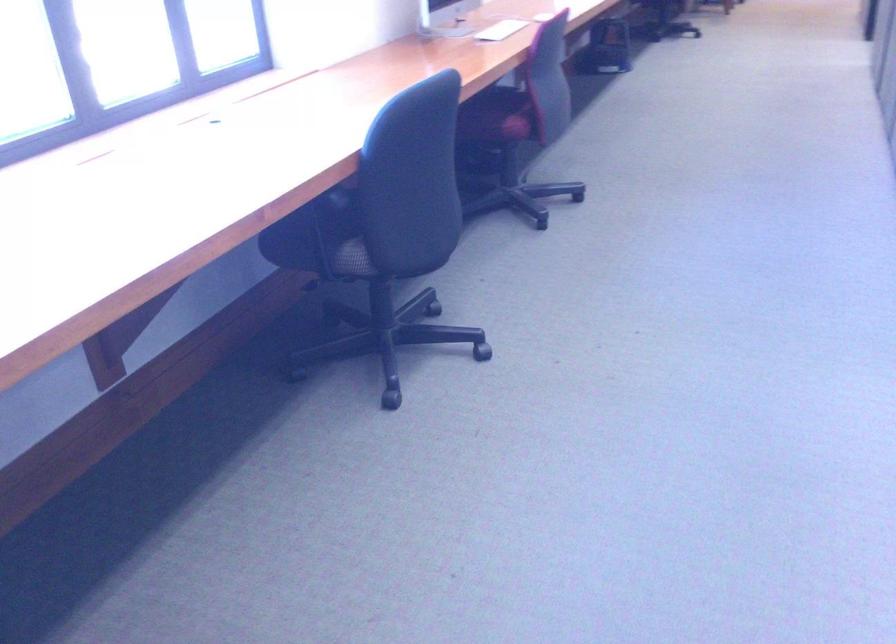
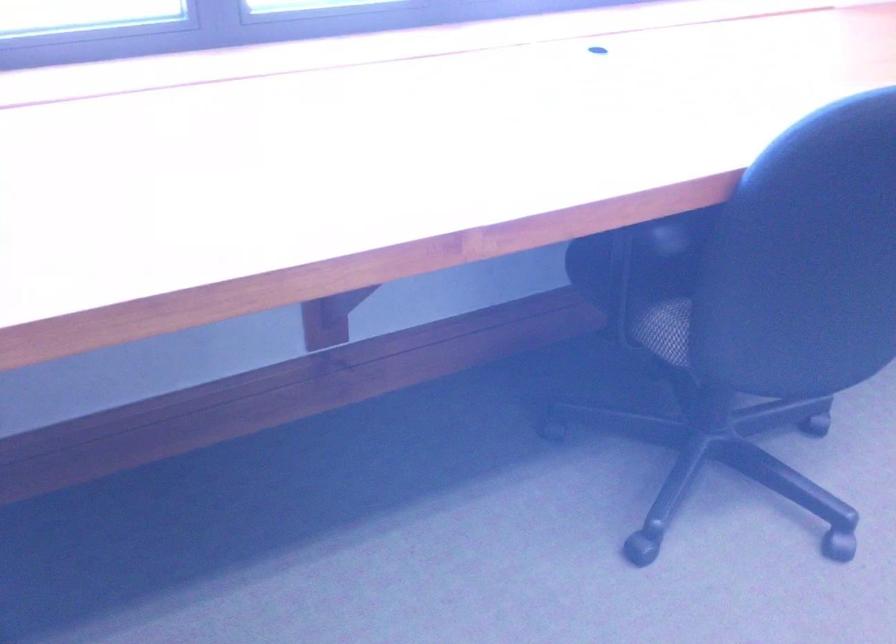
Question: The images are taken continuously from a first-person perspective. In which direction is your viewpoint rotating?

Choices:
 (A) Left
 (B) Right
 (C) Up
 (D) Down

Answer: (A)